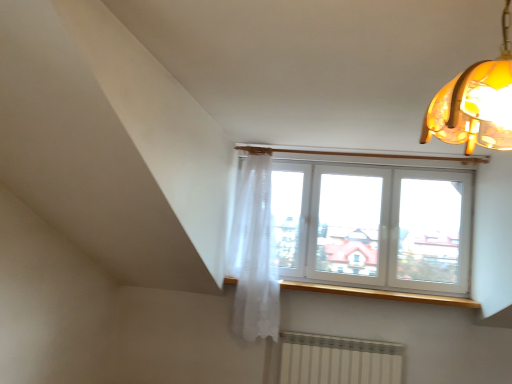
Question: From a real-world perspective, is translucent amber glass lampshade at upper right physically above white plastic window at upper center?

Choices:
 (A) no
 (B) yes

Answer: (B)

Question: Considering the relative sizes of translucent amber glass lampshade at upper right and white plastic window at upper center in the image provided, is translucent amber glass lampshade at upper right bigger than white plastic window at upper center?

Choices:
 (A) yes
 (B) no

Answer: (B)

Question: Is translucent amber glass lampshade at upper right to the right of white plastic window at upper center from the viewer's perspective?

Choices:
 (A) yes
 (B) no

Answer: (B)

Question: Would you say translucent amber glass lampshade at upper right contains white plastic window at upper center?

Choices:
 (A) no
 (B) yes

Answer: (A)

Question: Would you consider translucent amber glass lampshade at upper right to be distant from white plastic window at upper center?

Choices:
 (A) yes
 (B) no

Answer: (A)

Question: Is white plastic window at upper center taller or shorter than wooden at upper center?

Choices:
 (A) tall
 (B) short

Answer: (A)

Question: Is white plastic window at upper center bigger or smaller than wooden at upper center?

Choices:
 (A) big
 (B) small

Answer: (A)

Question: Does point (332, 248) appear closer or farther from the camera than point (437, 301)?

Choices:
 (A) farther
 (B) closer

Answer: (A)

Question: Is white plastic window at upper center wider or thinner than wooden at upper center?

Choices:
 (A) wide
 (B) thin

Answer: (B)

Question: Considering their positions, is white sheer curtain at upper center located in front of or behind translucent amber glass lampshade at upper right?

Choices:
 (A) front
 (B) behind

Answer: (B)

Question: In terms of width, does white sheer curtain at upper center look wider or thinner when compared to translucent amber glass lampshade at upper right?

Choices:
 (A) thin
 (B) wide

Answer: (A)

Question: Looking at the image, does white sheer curtain at upper center seem bigger or smaller compared to translucent amber glass lampshade at upper right?

Choices:
 (A) small
 (B) big

Answer: (B)

Question: Which is correct: white sheer curtain at upper center is inside translucent amber glass lampshade at upper right, or outside of it?

Choices:
 (A) outside
 (B) inside

Answer: (A)

Question: Is wooden at upper center wider or thinner than translucent amber glass lampshade at upper right?

Choices:
 (A) wide
 (B) thin

Answer: (B)

Question: Based on their positions, is wooden at upper center located to the left or right of translucent amber glass lampshade at upper right?

Choices:
 (A) left
 (B) right

Answer: (B)